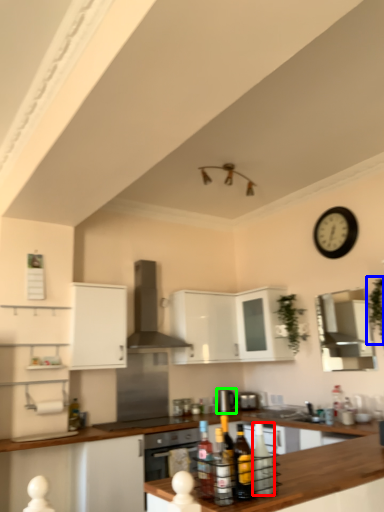
Question: Based on their relative distances, which object is farther from bottle (highlighted by a red box)? Choose from plant (highlighted by a blue box) and appliance (highlighted by a green box).

Choices:
 (A) plant
 (B) appliance

Answer: (B)